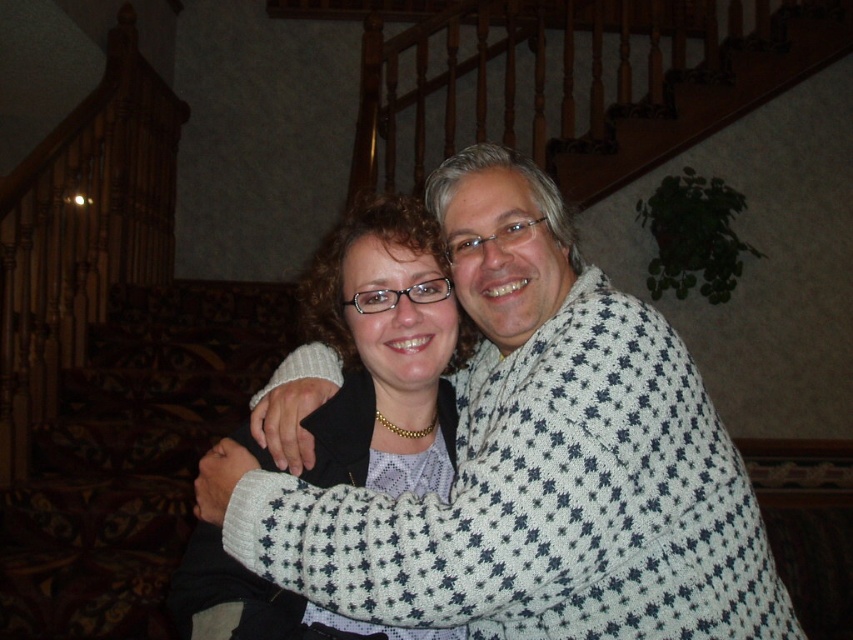
You are a photographer standing in front of the scene described. You want to take a closeup shot of the white dotted sweater at center. Considering your camera lens can focus on objects within 36 inches, can you capture the sweater without moving closer?

The white dotted sweater at center is 35.94 inches from the viewer, which is within the camera lens focus range of 36 inches. Therefore, you can capture the sweater without moving closer.

You are a fashion designer observing two sweaters in an image. The scene includes a staircase with wooden railings and a floral carpet. You need to determine which of the two sweaters at center is taller. The sweaters are labeled as white dotted sweater at center and white knit sweater at center. Which one is taller?

The white dotted sweater at center is taller than the white knit sweater at center according to the description.